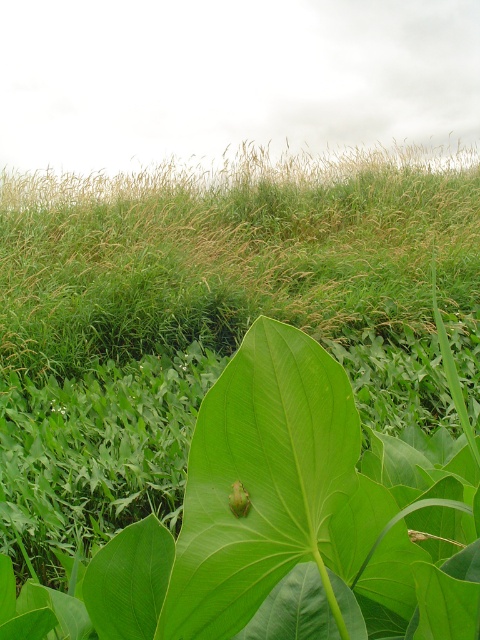
Question: Among these objects, which one is farthest from the camera?

Choices:
 (A) green matte leaf at center
 (B) green grass at center

Answer: (B)

Question: Does green grass at center appear under green matte leaf at center?

Choices:
 (A) yes
 (B) no

Answer: (B)

Question: Among these objects, which one is nearest to the camera?

Choices:
 (A) green grass at center
 (B) green matte leaf at center

Answer: (B)

Question: Can you confirm if green grass at center is positioned above green matte leaf at center?

Choices:
 (A) yes
 (B) no

Answer: (A)

Question: Does green grass at center lie behind green matte leaf at center?

Choices:
 (A) no
 (B) yes

Answer: (B)